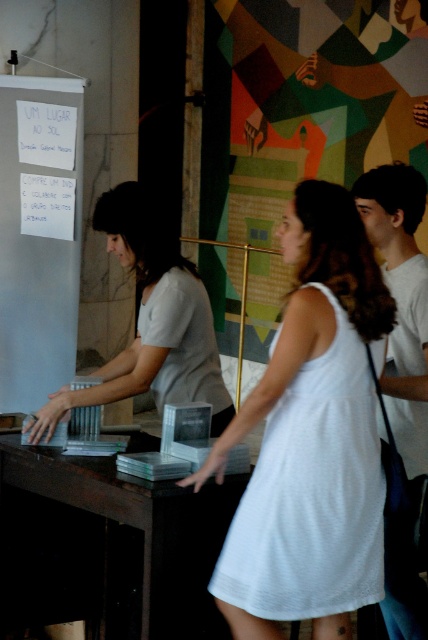
Does point (187, 288) come in front of point (410, 468)?

No, (187, 288) is further to viewer.

Is white matte dress at center above white cotton shirt at right?

Yes.

Is point (162, 365) closer to viewer compared to point (422, 284)?

No, (162, 365) is behind (422, 284).

Identify the location of white matte dress at center. The height and width of the screenshot is (640, 428). coord(151,320).

Does white cotton dress at center have a larger size compared to white matte dress at center?

Actually, white cotton dress at center might be smaller than white matte dress at center.

Can you confirm if white cotton dress at center is taller than white matte dress at center?

Yes.

Is point (318, 397) behind point (151, 317)?

That is False.

This screenshot has width=428, height=640. Find the location of `white cotton dress at center`. white cotton dress at center is located at coordinates (312, 493).

Is white paper at left wider than white cotton shirt at right?

Correct, the width of white paper at left exceeds that of white cotton shirt at right.

Does white paper at left appear on the right side of white cotton shirt at right?

In fact, white paper at left is to the left of white cotton shirt at right.

Who is more forward, (2, 250) or (412, 346)?

Positioned in front is point (412, 346).

Find the location of a particular element. This screenshot has height=640, width=428. white paper at left is located at coordinates (38, 234).